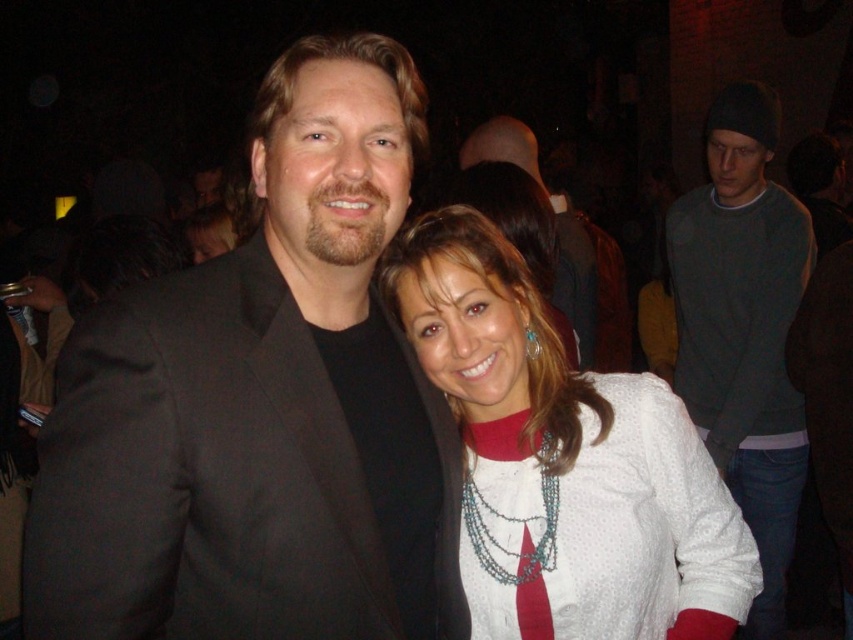
You are a photographer at the party and want to take a closeup shot of the teal beaded necklace at center. However, the white dotted shirt at center is blocking the view. Can you adjust the angle so that the necklace is visible without the shirt covering it?

The white dotted shirt at center is positioned over the teal beaded necklace at center, so adjusting the angle might allow the necklace to be visible if the shirt isn not completely covering it. However, since the shirt is directly over the necklace, it may still block the view depending on how much overlap there is.

You are at a party and want to take a photo of the two people standing at the points labeled point (786, 390) and point (592, 266). Which point corresponds to the person who is closer to the camera?

Point (786, 390) is in front of point (592, 266), so the person at point (786, 390) is closer to the camera.

You are a photographer at a party who wants to take a group photo of two people wearing the white dotted shirt at center and dark gray sweater at right. The camera you have can only focus on subjects within 1.5 meters of each other. Will the two subjects be within the camera focus range?

The white dotted shirt at center is 1.48 meters from the dark gray sweater at right, which is within the camera focus range of 1.5 meters. Therefore, the two subjects will be within the camera focus range.